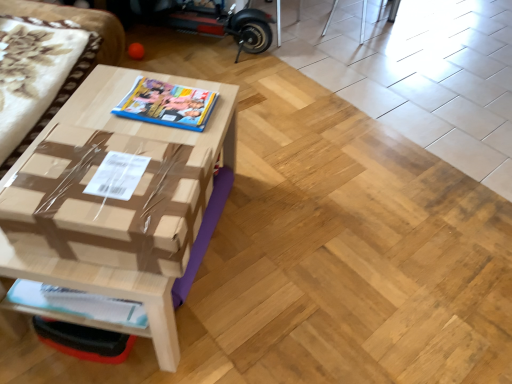
Locate an element on the screen. The width and height of the screenshot is (512, 384). free region under matte plastic magazine at center, placed as the 2th magazine when sorted from front to back (from a real-world perspective) is located at coordinates coord(164,105).